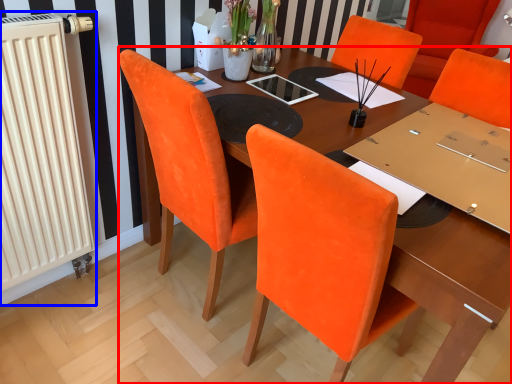
Question: Which point is closer to the camera, table (highlighted by a red box) or radiator (highlighted by a blue box)?

Choices:
 (A) table
 (B) radiator

Answer: (A)